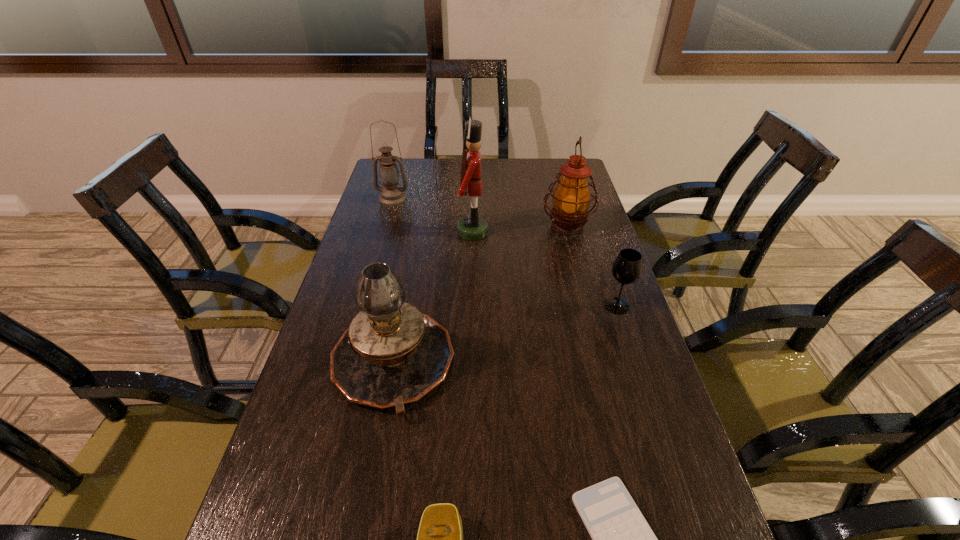
Where is `free space located 0.180m on the left of the third shortest object`? free space located 0.180m on the left of the third shortest object is located at coordinates pyautogui.click(x=537, y=306).

The height and width of the screenshot is (540, 960). What are the coordinates of `oil lamp positioned at the right edge` in the screenshot? It's located at (571, 198).

The height and width of the screenshot is (540, 960). Identify the location of wineglass situated at the right edge. (627, 268).

The image size is (960, 540). Identify the location of free region at the far edge of the desktop. (540, 172).

The height and width of the screenshot is (540, 960). I want to click on blank space at the left edge of the desktop, so pos(356,234).

The height and width of the screenshot is (540, 960). Identify the location of free space at the right edge of the desktop. (596, 246).

At what (x,y) coordinates should I click in order to perform the action: click on free space between the tallest object and the rightmost oil lamp. Please return your answer as a coordinate pair (x, y). This screenshot has height=540, width=960. Looking at the image, I should click on (520, 229).

This screenshot has height=540, width=960. What are the coordinates of `vacant space in between the second farthest oil lamp and the nearest oil lamp` in the screenshot? It's located at (480, 295).

Find the location of a particular element. The height and width of the screenshot is (540, 960). free spot between the rightmost oil lamp and the fourth farthest object is located at coordinates (592, 266).

Where is `blank region between the fourth farthest object and the second nearest oil lamp`? blank region between the fourth farthest object and the second nearest oil lamp is located at coordinates point(592,266).